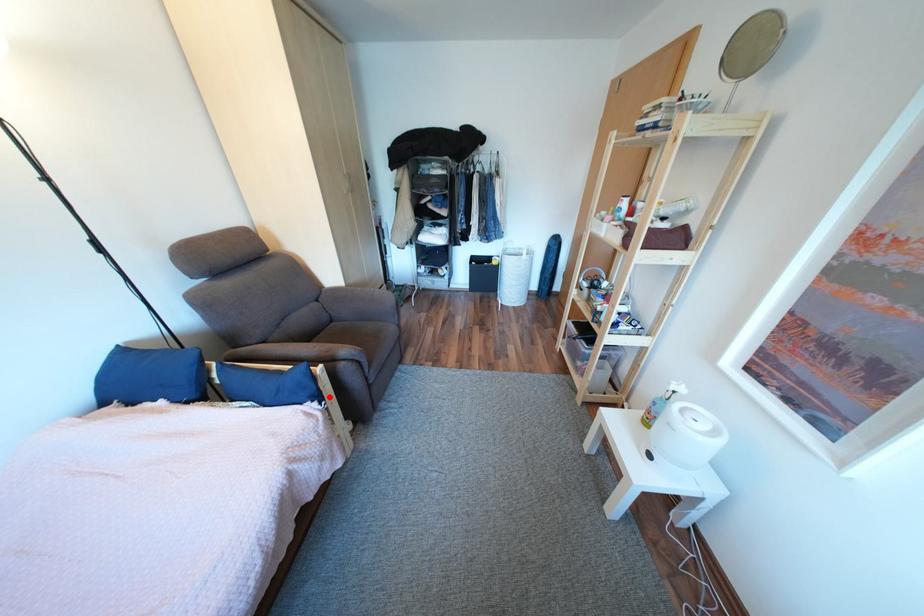
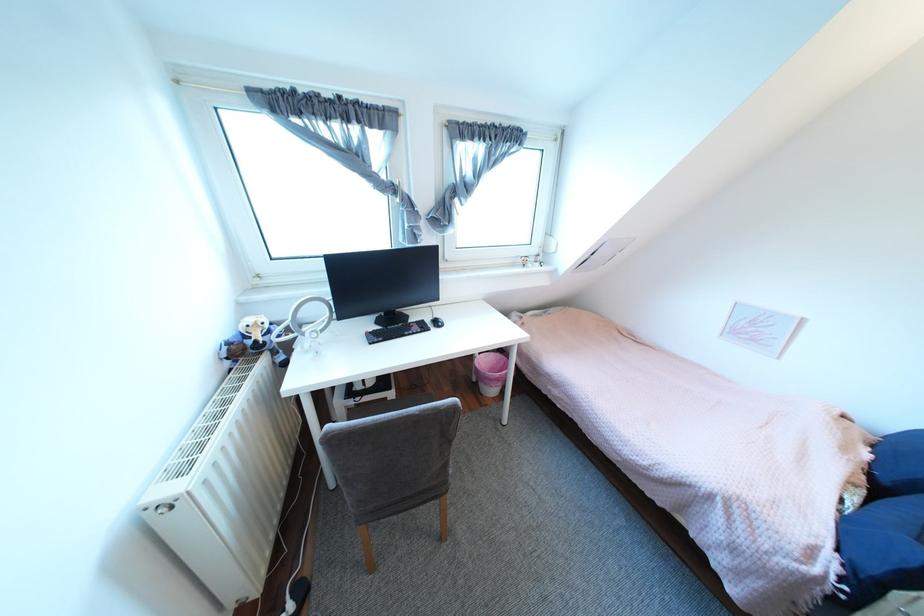
Question: I am providing you with two images of the same scene from different viewpoints. A red point is marked on the first image. Is the red point's position out of view in image 2?

Choices:
 (A) Yes
 (B) No

Answer: (B)